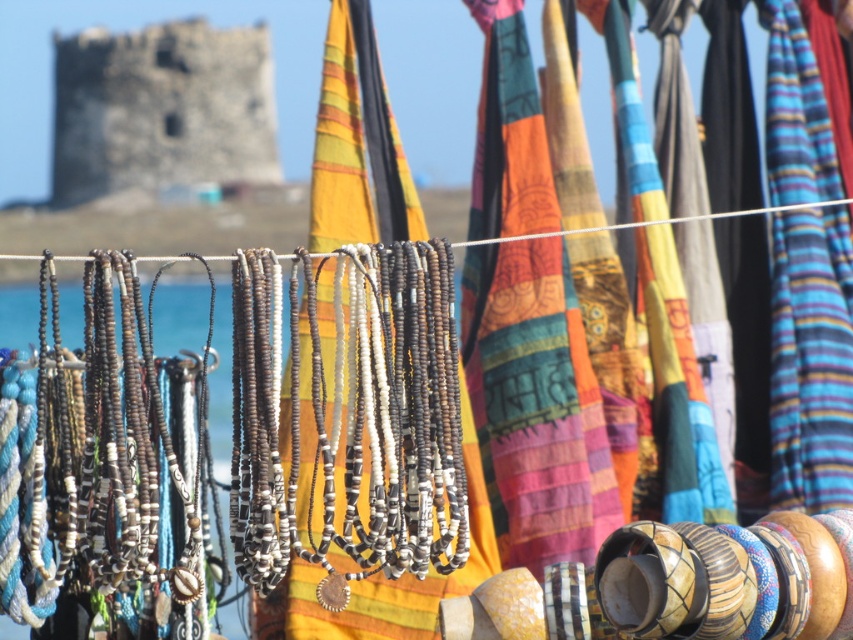
Which is more to the right, silver metallic beads at center or stone tower at upper left?

Positioned to the right is silver metallic beads at center.

Can you confirm if silver metallic beads at center is taller than stone tower at upper left?

No.

Measure the distance between silver metallic beads at center and camera.

A distance of 42.53 meters exists between silver metallic beads at center and camera.

Find the location of a particular element. This screenshot has width=853, height=640. silver metallic beads at center is located at coordinates (349, 417).